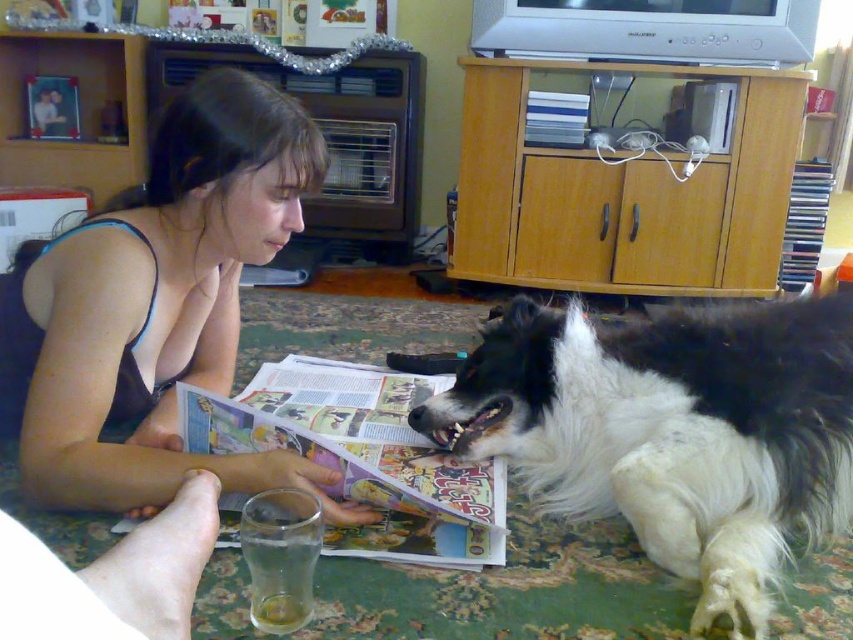
You are a delivery robot that needs to place a small package between the black and white fur at lower right and the printed paper magazine at lower center. Can you fit the package there if it measures 12 inches long?

The distance between the black and white fur at lower right and the printed paper magazine at lower center is 11.49 inches, which is shorter than the 12 inch package. Therefore, the package cannot fit between them.

You are a delivery person who needs to place a small package between the black and white fur at lower right and the hardcover book at upper center. Can you fit the package there?

The black and white fur at lower right is larger in size than the hardcover book at upper center, so there might be enough space between them to place the small package.

You are a photographer trying to capture the exact position of the black and white fur at lower right in the image. According to the coordinates provided, where would you focus your camera?

The black and white fur at lower right is located at coordinates point [671,432], so you should focus your camera there.